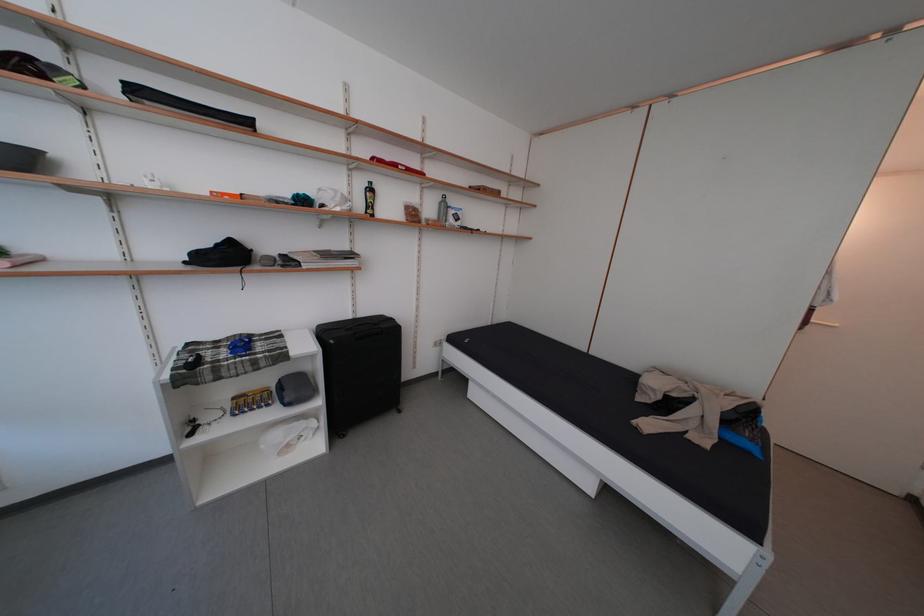
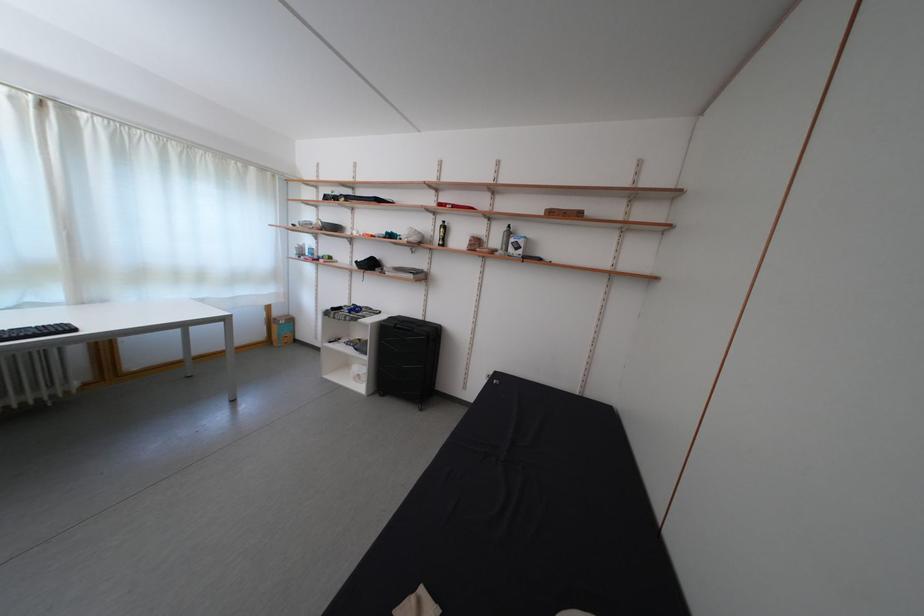
The point at (301, 448) is marked in the first image. Where is the corresponding point in the second image?

(365, 381)